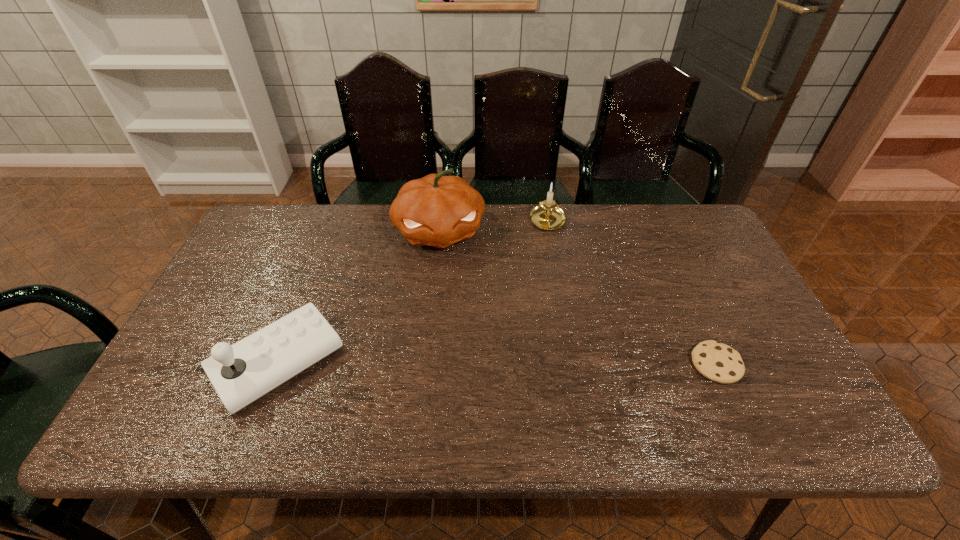
The image size is (960, 540). I want to click on object that is at the near left corner, so click(241, 373).

Where is `object present at the near right corner`? object present at the near right corner is located at coordinates (718, 362).

Identify the location of vacant space at the far edge. This screenshot has width=960, height=540. (655, 240).

The height and width of the screenshot is (540, 960). Identify the location of vacant region at the near edge of the desktop. (669, 369).

In the image, there is a desktop. Identify the location of vacant space at the left edge. (242, 284).

The height and width of the screenshot is (540, 960). What are the coordinates of `vacant point at the far left corner` in the screenshot? It's located at (272, 231).

You are a GUI agent. You are given a task and a screenshot of the screen. Output one action in this format:
    pyautogui.click(x=<x>, y=<y>)
    Task: Click on the unoccupied area between the pumpkin and the joystick
    Image resolution: width=960 pixels, height=540 pixels.
    Given the screenshot: What is the action you would take?
    pyautogui.click(x=359, y=296)

The width and height of the screenshot is (960, 540). Identify the location of vacant region between the cookie and the second object from right to left. (632, 293).

Locate an element on the screen. free space between the second object from right to left and the leftmost object is located at coordinates (413, 292).

This screenshot has width=960, height=540. I want to click on vacant area between the leftmost object and the cookie, so click(497, 363).